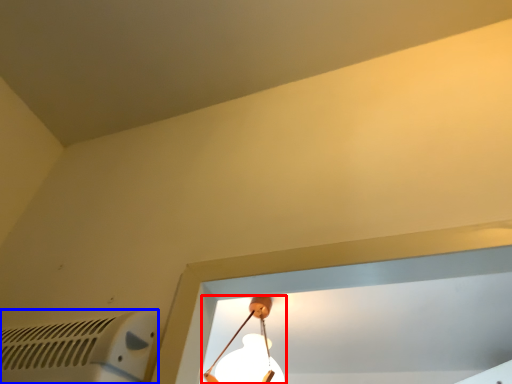
Question: Which point is further to the camera, lamp (highlighted by a red box) or air conditioning (highlighted by a blue box)?

Choices:
 (A) lamp
 (B) air conditioning

Answer: (A)